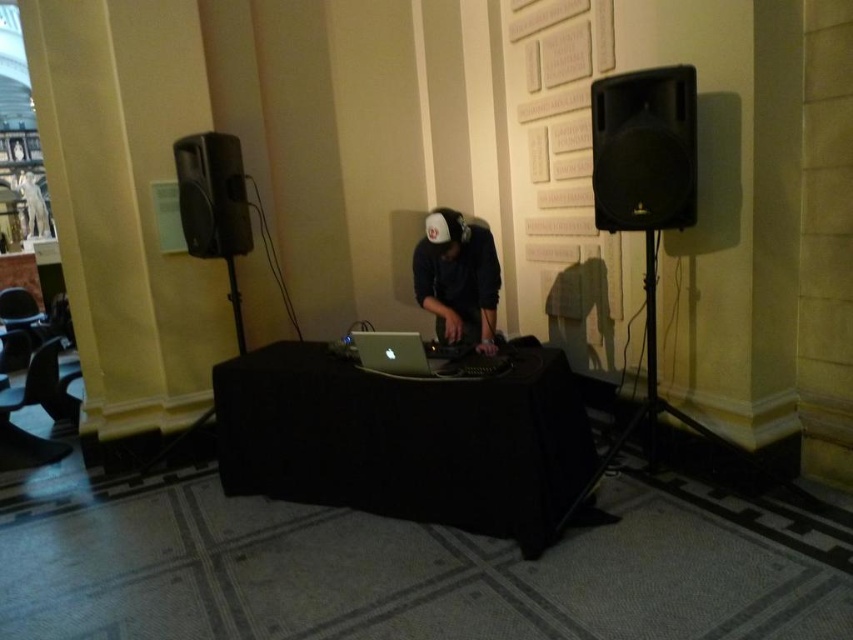
Question: Does black matte speaker at right appear on the right side of silver metallic laptop at center?

Choices:
 (A) yes
 (B) no

Answer: (A)

Question: Which point is closer to the camera?

Choices:
 (A) (646, 164)
 (B) (238, 362)
 (C) (421, 340)

Answer: (A)

Question: Estimate the real-world distances between objects in this image. Which object is closer to the black matte speaker at right?

Choices:
 (A) black matte speaker at left
 (B) black fabric table at center

Answer: (B)

Question: Does black fabric table at center come in front of black matte hoodie at center?

Choices:
 (A) yes
 (B) no

Answer: (A)

Question: Is black fabric table at center to the left of black matte speaker at right from the viewer's perspective?

Choices:
 (A) yes
 (B) no

Answer: (A)

Question: Which object is closer to the camera taking this photo?

Choices:
 (A) black matte speaker at left
 (B) black fabric table at center

Answer: (B)